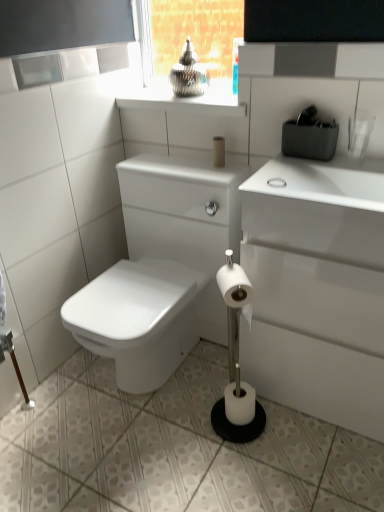
Find the location of a particular element. free spot below white glossy toilet at lower left (from a real-world perspective) is located at coordinates (167, 380).